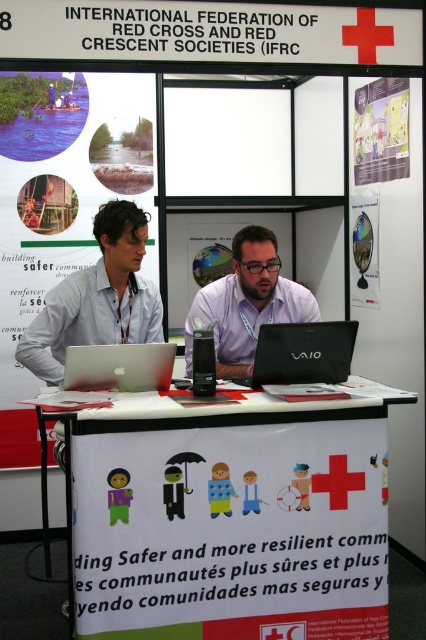
Question: Which point appears farthest from the camera in this image?

Choices:
 (A) pyautogui.click(x=403, y=170)
 (B) pyautogui.click(x=359, y=246)
 (C) pyautogui.click(x=284, y=330)

Answer: (B)

Question: Can you confirm if white paper at upper left is wider than matte purple shirt at center?

Choices:
 (A) yes
 (B) no

Answer: (A)

Question: Based on their relative distances, which object is farther from the white fabric banner at center?

Choices:
 (A) matte silver laptop at center
 (B) matte paper poster at upper right
 (C) glossy plastic globe at upper right
 (D) white paper at upper left

Answer: (B)

Question: Which of the following is the closest to the observer?

Choices:
 (A) (402, 90)
 (B) (360, 289)
 (C) (143, 362)
 (D) (94, 177)

Answer: (C)

Question: Is white paper at upper left above glossy plastic globe at upper right?

Choices:
 (A) no
 (B) yes

Answer: (A)

Question: Does black matte laptop at center appear under glossy plastic globe at upper right?

Choices:
 (A) yes
 (B) no

Answer: (A)